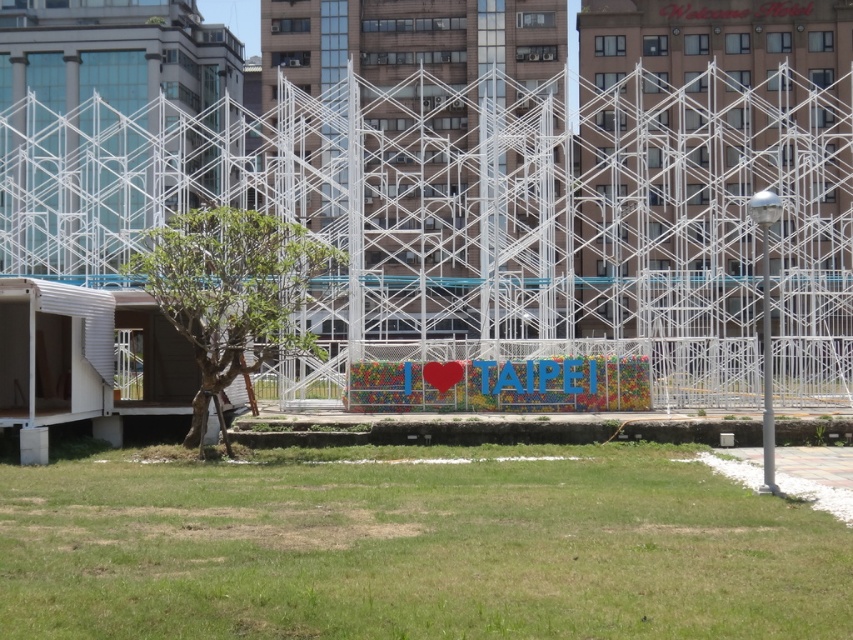
Question: Can you confirm if green grass at lower center is bigger than green leafy tree at left?

Choices:
 (A) yes
 (B) no

Answer: (A)

Question: Which point is closer to the camera?

Choices:
 (A) green leafy tree at left
 (B) green grass at lower center

Answer: (B)

Question: Is green grass at lower center to the right of green leafy tree at left from the viewer's perspective?

Choices:
 (A) no
 (B) yes

Answer: (B)

Question: Observing the image, what is the correct spatial positioning of white metallic scaffolding at center in reference to green grass at lower center?

Choices:
 (A) below
 (B) above

Answer: (B)

Question: Considering the real-world distances, which object is closest to the white metallic scaffolding at center?

Choices:
 (A) green leafy tree at left
 (B) green grass at lower center

Answer: (B)

Question: Which point is farther to the camera?

Choices:
 (A) green grass at lower center
 (B) white metallic scaffolding at center

Answer: (B)